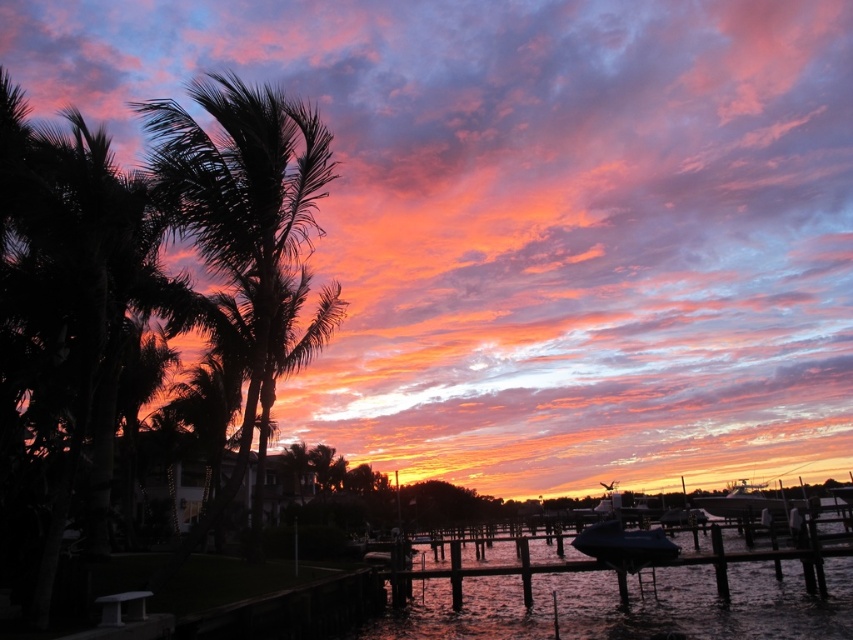
Who is lower down, glossy water at dock center or shiny blue boat at lower right?

shiny blue boat at lower right is lower down.

Does glossy water at dock center appear under shiny blue boat at lower right?

Actually, glossy water at dock center is above shiny blue boat at lower right.

Image resolution: width=853 pixels, height=640 pixels. What are the coordinates of `glossy water at dock center` in the screenshot? It's located at (x=631, y=605).

Who is taller, silky black palm tree at left or blue tarpaulin boat at lower right?

Standing taller between the two is silky black palm tree at left.

Is point (242, 205) positioned in front of point (621, 548)?

Yes, point (242, 205) is closer to viewer.

The width and height of the screenshot is (853, 640). I want to click on silky black palm tree at left, so click(242, 212).

Which is more to the right, dark green leafy palm tree at left or blue tarpaulin boat at lower right?

blue tarpaulin boat at lower right is more to the right.

Who is more forward, [78,134] or [584,548]?

Positioned in front is point [78,134].

Where is `dark green leafy palm tree at left`? The height and width of the screenshot is (640, 853). dark green leafy palm tree at left is located at coordinates (93, 280).